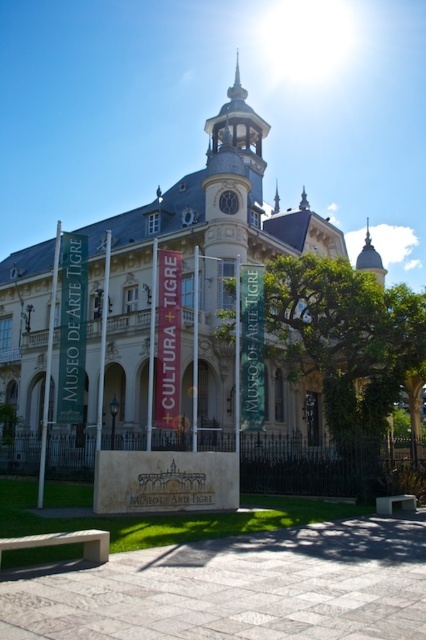
From the picture: Is light gray stone clock tower at upper center closer to the viewer compared to wooden park bench at lower right?

No, light gray stone clock tower at upper center is behind wooden park bench at lower right.

Is light gray stone clock tower at upper center to the left of wooden park bench at lower right from the viewer's perspective?

Correct, you'll find light gray stone clock tower at upper center to the left of wooden park bench at lower right.

What do you see at coordinates (239, 132) in the screenshot? I see `light gray stone clock tower at upper center` at bounding box center [239, 132].

Where is `light gray stone clock tower at upper center`? This screenshot has width=426, height=640. light gray stone clock tower at upper center is located at coordinates (239, 132).

Can you confirm if smooth concrete bench at lower left is bigger than wooden park bench at lower right?

Indeed, smooth concrete bench at lower left has a larger size compared to wooden park bench at lower right.

Describe the element at coordinates (63, 541) in the screenshot. The image size is (426, 640). I see `smooth concrete bench at lower left` at that location.

Describe the element at coordinates (63, 541) in the screenshot. The width and height of the screenshot is (426, 640). I see `smooth concrete bench at lower left` at that location.

Identify the location of smooth concrete bench at lower left. (63, 541).

Is point (258, 172) positioned behind point (66, 541)?

Yes, point (258, 172) is behind point (66, 541).

Between light gray stone clock tower at upper center and smooth concrete bench at lower left, which one appears on the right side from the viewer's perspective?

Positioned to the right is light gray stone clock tower at upper center.

Where is `light gray stone clock tower at upper center`? light gray stone clock tower at upper center is located at coordinates (239, 132).